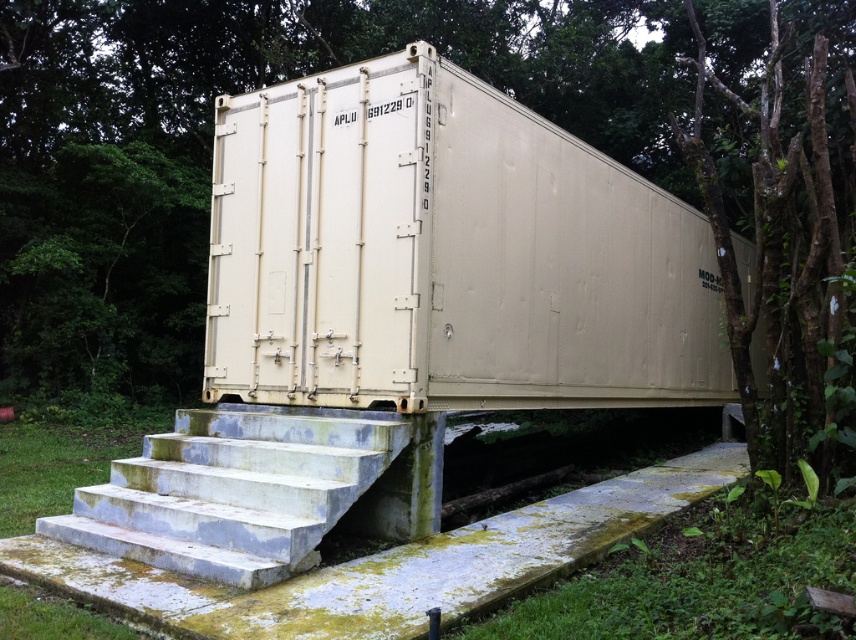
You are standing at the origin point of a coordinate system. You need to move to the beige matte container at center. What are the coordinates you need to move to?

The coordinates to move to are 0.398 on the x axis and 0.522 on the y axis.